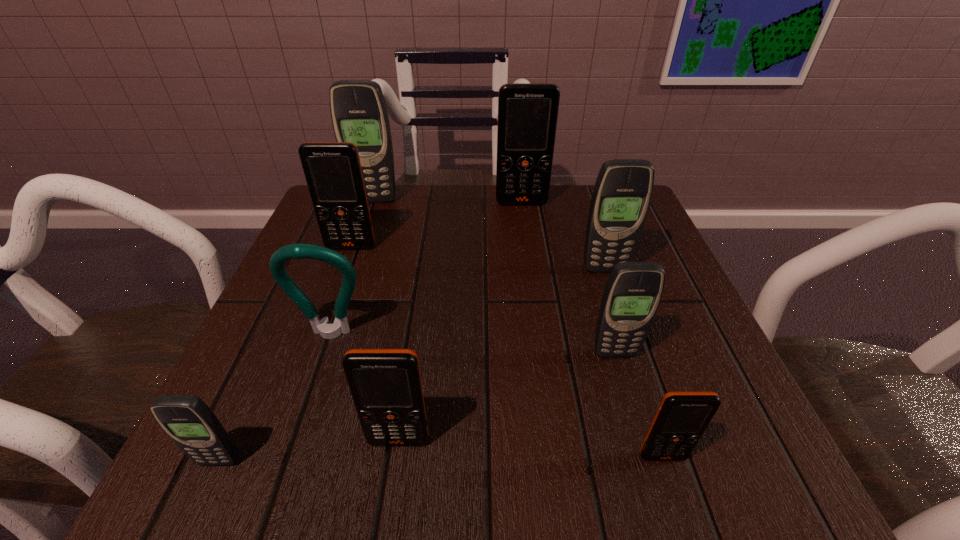
Find the location of a particular element. The image size is (960, 540). the fourth nearest object is located at coordinates (633, 291).

Where is `the fifth cellular telephone from right to left`? The height and width of the screenshot is (540, 960). the fifth cellular telephone from right to left is located at coordinates (385, 384).

I want to click on the second nearest orange cellular telephone, so click(385, 384).

The height and width of the screenshot is (540, 960). Identify the location of the smallest orange cellular telephone. (682, 417).

At what (x,y) coordinates should I click in order to perform the action: click on the nearest orange cellular telephone. Please return your answer as a coordinate pair (x, y). Looking at the image, I should click on (682, 417).

At what (x,y) coordinates should I click in order to perform the action: click on the smallest gray cellular telephone. Please return your answer as a coordinate pair (x, y). Looking at the image, I should click on (187, 420).

This screenshot has width=960, height=540. I want to click on free space located on the screen of the sixth object from left to right, so [526, 232].

Locate an element on the screen. The height and width of the screenshot is (540, 960). free location located 0.130m on the screen of the biggest gray cellular telephone is located at coordinates (363, 236).

Locate an element on the screen. The image size is (960, 540). free space located 0.210m on the screen of the seventh nearest object is located at coordinates (322, 328).

Find the location of a particular element. The image size is (960, 540). free space located 0.380m on the screen of the second farthest gray cellular telephone is located at coordinates (671, 469).